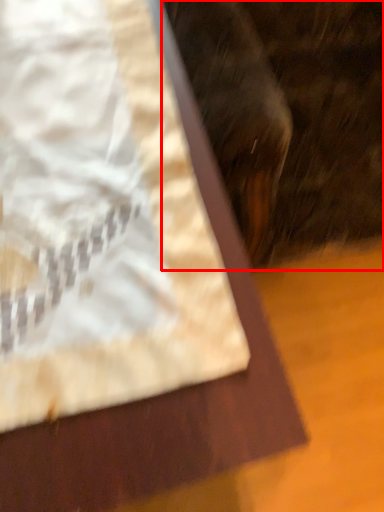
Question: In this image, where is animal (annotated by the red box) located relative to sheet?

Choices:
 (A) right
 (B) left

Answer: (A)